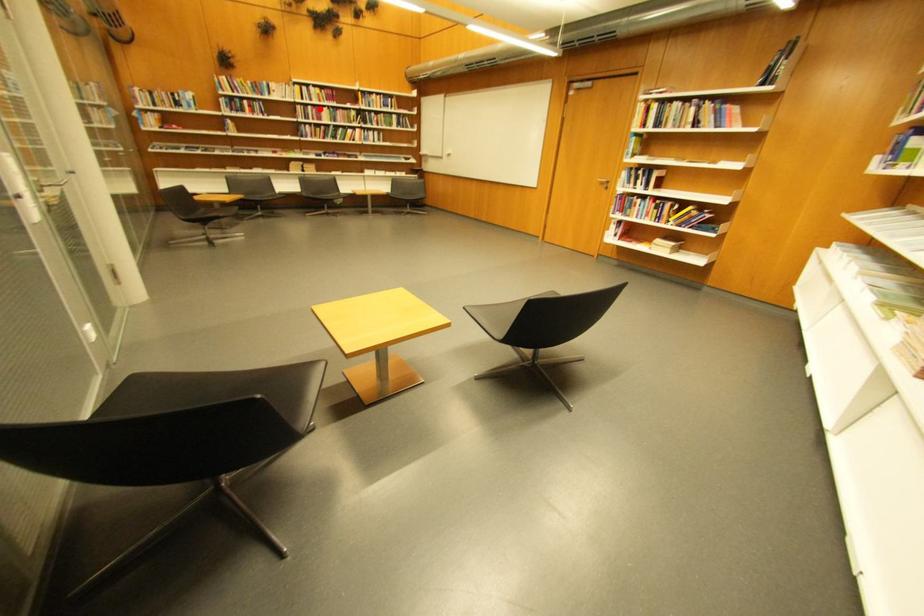
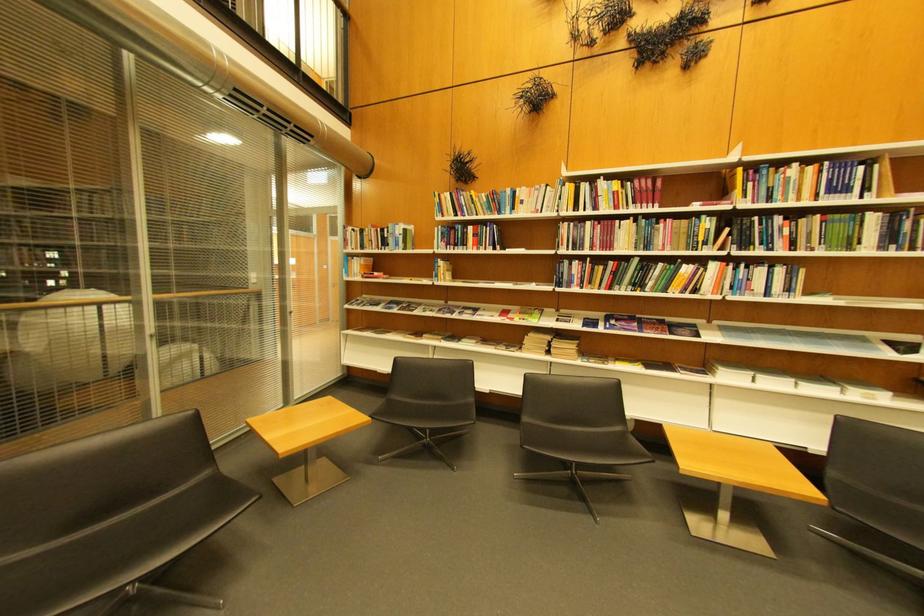
Find the pixel in the second image that matches the highlighted location in the first image.

(600, 225)